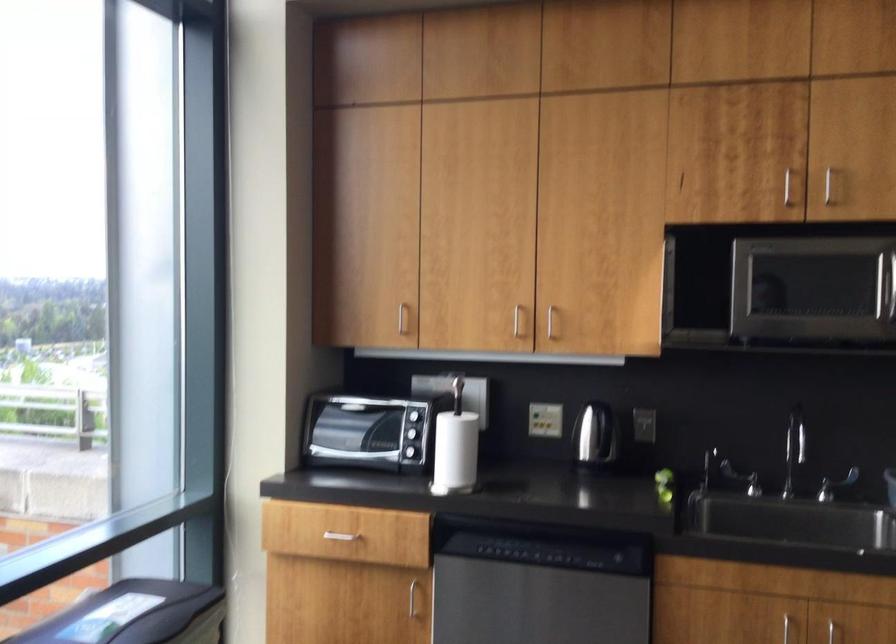
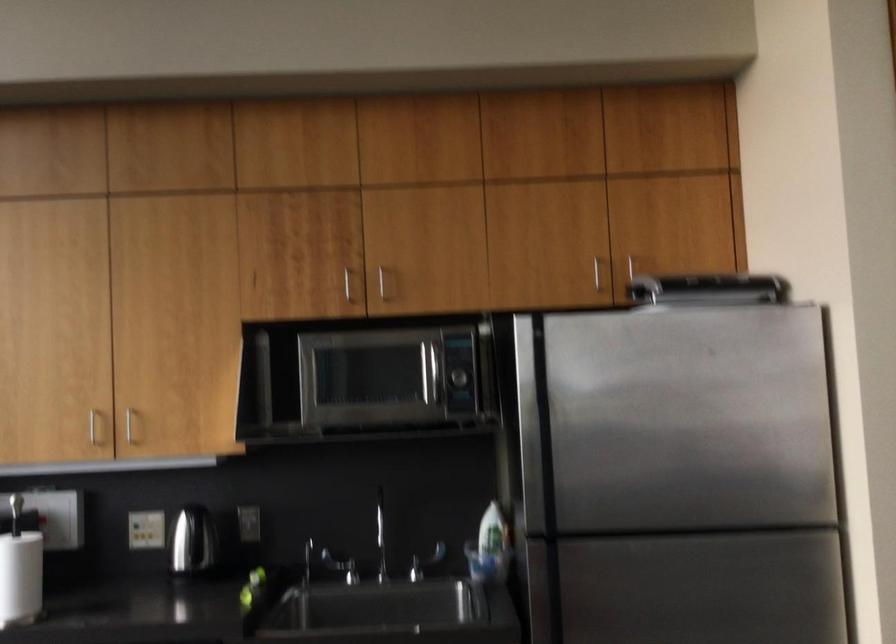
Which direction would the cameraman need to move to produce the second image?

The cameraman moved toward right, backward.